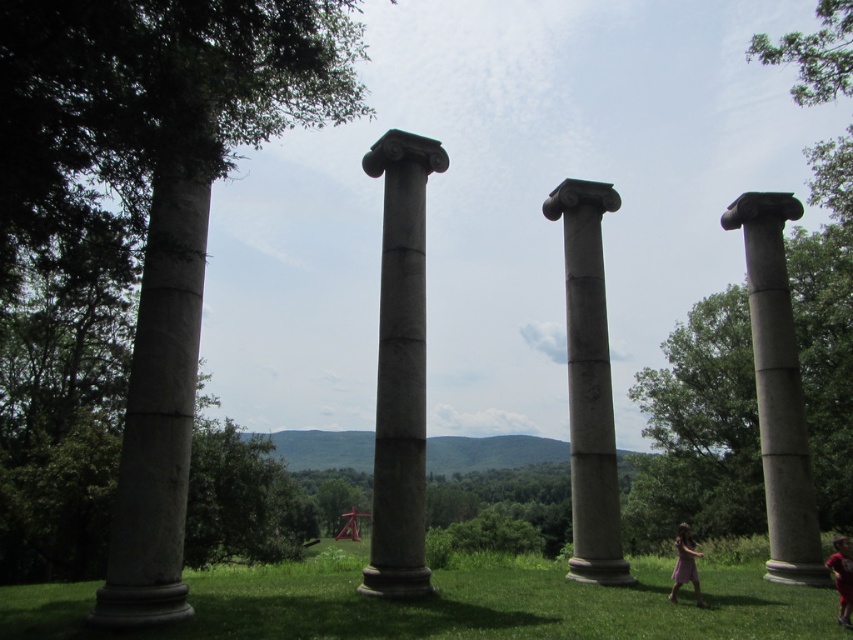
Which is in front, point (769, 296) or point (839, 580)?

Positioned in front is point (839, 580).

Is gray stone column at right shorter than light brown wooden child at lower right?

In fact, gray stone column at right may be taller than light brown wooden child at lower right.

Which is in front, point (824, 570) or point (846, 541)?

Positioned in front is point (846, 541).

This screenshot has height=640, width=853. In order to click on gray stone column at right in this screenshot , I will do `click(778, 388)`.

Does smooth gray column at left appear over gray stone column at center?

No.

Can you confirm if smooth gray column at left is smaller than gray stone column at center?

No.

What do you see at coordinates (161, 387) in the screenshot?
I see `smooth gray column at left` at bounding box center [161, 387].

Locate an element on the screen. The height and width of the screenshot is (640, 853). smooth gray column at left is located at coordinates (161, 387).

Which of these two, green grass at lower center or smooth gray column at left, stands shorter?

Standing shorter between the two is green grass at lower center.

Which is behind, point (247, 612) or point (144, 355)?

Point (144, 355)

Which is in front, point (693, 625) or point (170, 541)?

Point (693, 625) is more forward.

Identify the location of green grass at lower center. (447, 605).